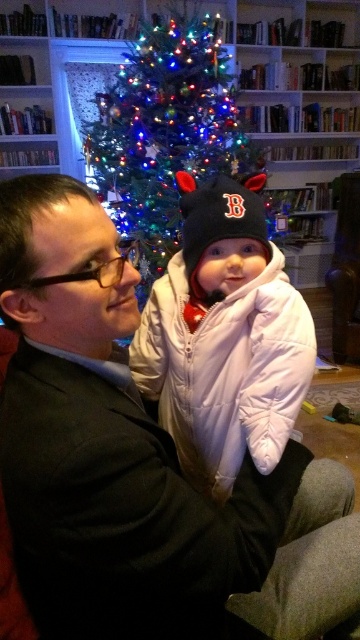
Question: Can you confirm if matte black suit at center is positioned above white puffy coat at center?

Choices:
 (A) no
 (B) yes

Answer: (A)

Question: Is white puffy coat at center thinner than green matte christmas tree at center?

Choices:
 (A) yes
 (B) no

Answer: (A)

Question: Which of the following is the farthest from the observer?

Choices:
 (A) white puffy coat at center
 (B) black knit hat at center
 (C) green matte christmas tree at center

Answer: (C)

Question: Among these objects, which one is nearest to the camera?

Choices:
 (A) black knit hat at center
 (B) white puffy coat at center
 (C) matte black suit at center

Answer: (C)

Question: Which point is closer to the camera taking this photo?

Choices:
 (A) (102, 512)
 (B) (191, 241)
 (C) (129, 93)

Answer: (A)

Question: Is matte black suit at center closer to camera compared to green matte christmas tree at center?

Choices:
 (A) yes
 (B) no

Answer: (A)